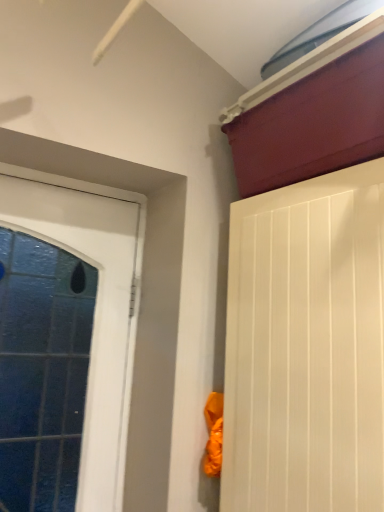
Image resolution: width=384 pixels, height=512 pixels. In order to click on metallic silver exhaust hood at upper right in this screenshot , I will do click(x=319, y=33).

Describe the element at coordinates (319, 33) in the screenshot. The image size is (384, 512). I see `metallic silver exhaust hood at upper right` at that location.

What is the approximate width of metallic silver exhaust hood at upper right?

3.37 inches.

Find the location of `metallic silver exhaust hood at upper right`. metallic silver exhaust hood at upper right is located at coordinates (319, 33).